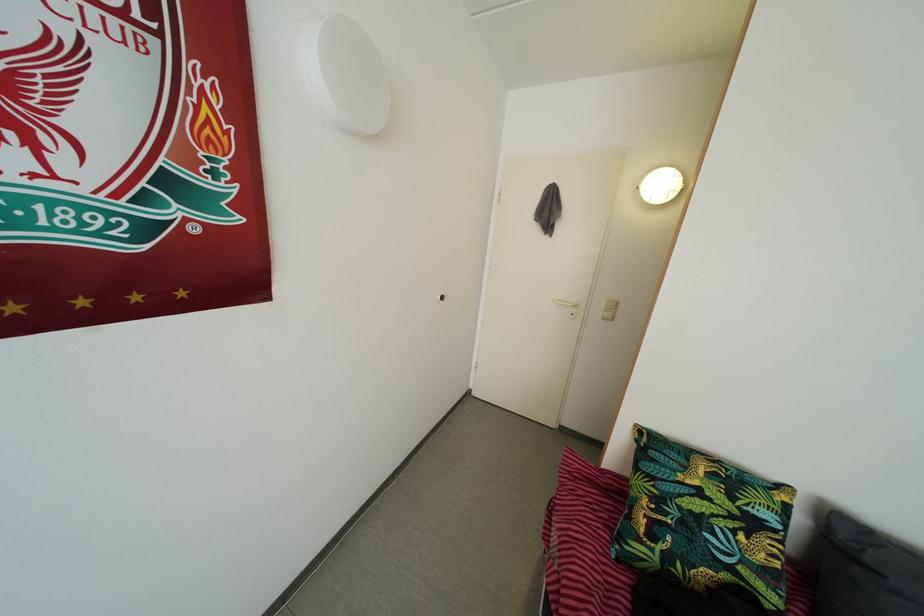
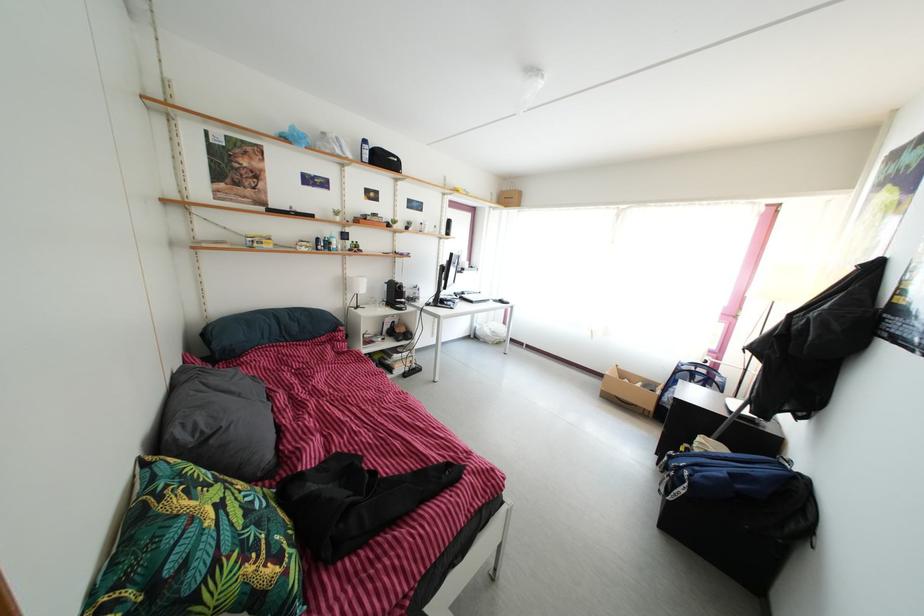
Locate, in the second image, the point that corresponds to (x=862, y=576) in the first image.

(217, 450)